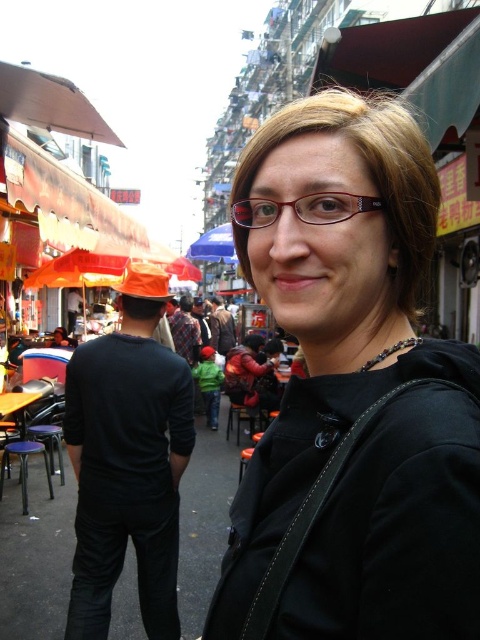
Question: Which point is farther to the camera?

Choices:
 (A) (x=212, y=241)
 (B) (x=129, y=456)
 (C) (x=345, y=193)

Answer: (A)

Question: Is black matte shirt at center wider than matte red glasses at center?

Choices:
 (A) no
 (B) yes

Answer: (B)

Question: Which of these objects is positioned closest to the matte black jacket at center?

Choices:
 (A) matte red glasses at center
 (B) black matte shirt at center
 (C) blue fabric umbrella at center

Answer: (A)

Question: Based on their relative distances, which object is nearer to the matte black jacket at center?

Choices:
 (A) matte red glasses at center
 (B) black matte shirt at center
 (C) blue fabric umbrella at center

Answer: (A)

Question: Is matte red glasses at center bigger than blue fabric umbrella at center?

Choices:
 (A) no
 (B) yes

Answer: (A)

Question: Where is black matte shirt at center located in relation to blue fabric umbrella at center in the image?

Choices:
 (A) left
 (B) right

Answer: (B)